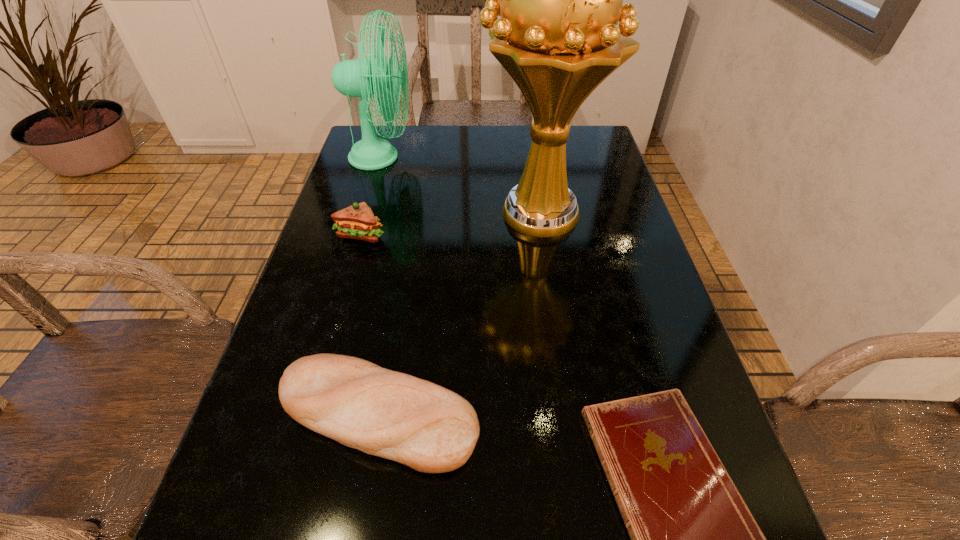
Find the location of `vacant space that satisfies the following two spatial constraints: 1. on the back side of the bread; 2. in front of the second tallest object to blow air`. vacant space that satisfies the following two spatial constraints: 1. on the back side of the bread; 2. in front of the second tallest object to blow air is located at coordinates (421, 157).

Locate an element on the screen. The width and height of the screenshot is (960, 540). free space in the image that satisfies the following two spatial constraints: 1. on the back side of the second shortest object; 2. in front of the fourth shortest object to blow air is located at coordinates (421, 157).